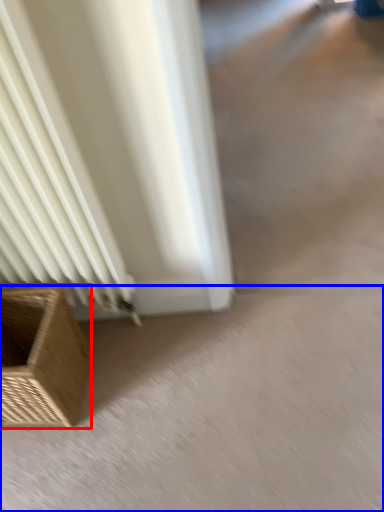
Question: Which of the following is the farthest to the observer, furniture (highlighted by a red box) or concrete (highlighted by a blue box)?

Choices:
 (A) furniture
 (B) concrete

Answer: (B)